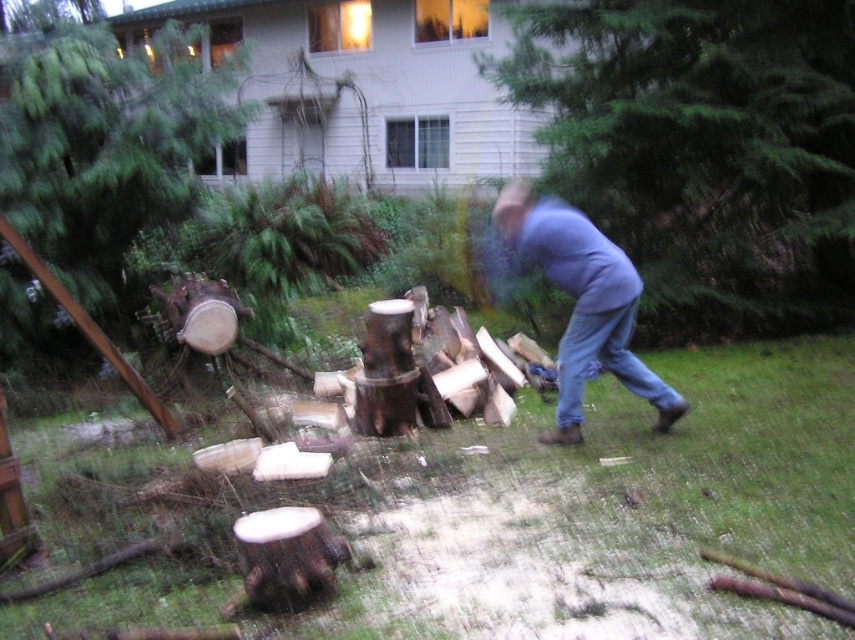
Which is below, green rough wood at center or blue jeans at center?

Positioned lower is blue jeans at center.

Is green rough wood at center further to the viewer compared to blue jeans at center?

Yes, green rough wood at center is behind blue jeans at center.

Is point (844, 45) behind point (628, 372)?

Yes, it is.

The height and width of the screenshot is (640, 855). I want to click on green rough wood at center, so click(702, 148).

I want to click on blue jeans at center, so click(x=582, y=304).

Describe the element at coordinates (582, 304) in the screenshot. I see `blue jeans at center` at that location.

Is point (553, 216) positioned in front of point (575, 401)?

Yes, it is.

You are a GUI agent. You are given a task and a screenshot of the screen. Output one action in this format:
    pyautogui.click(x=<x>, y=<y>)
    Task: Click on the blue jeans at center
    This screenshot has width=855, height=640.
    Given the screenshot: What is the action you would take?
    pyautogui.click(x=582, y=304)

Between point (761, 84) and point (111, 163), which one is positioned in front?

Point (111, 163)

Is green rough wood at center positioned in front of smooth brown stump at left?

That is False.

Where is `green rough wood at center`? The width and height of the screenshot is (855, 640). green rough wood at center is located at coordinates (702, 148).